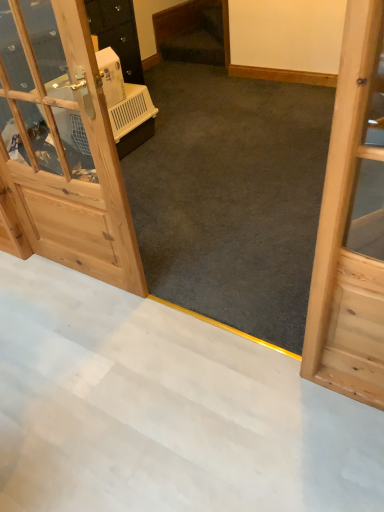
This screenshot has height=512, width=384. Describe the element at coordinates (352, 223) in the screenshot. I see `natural wood door at right` at that location.

You are a GUI agent. You are given a task and a screenshot of the screen. Output one action in this format:
    pyautogui.click(x=<x>, y=<y>)
    Task: Click on the natural wood door at right
    This screenshot has height=512, width=384.
    Given the screenshot: What is the action you would take?
    pyautogui.click(x=352, y=223)

Where is `natural wood door at right`? The width and height of the screenshot is (384, 512). natural wood door at right is located at coordinates (352, 223).